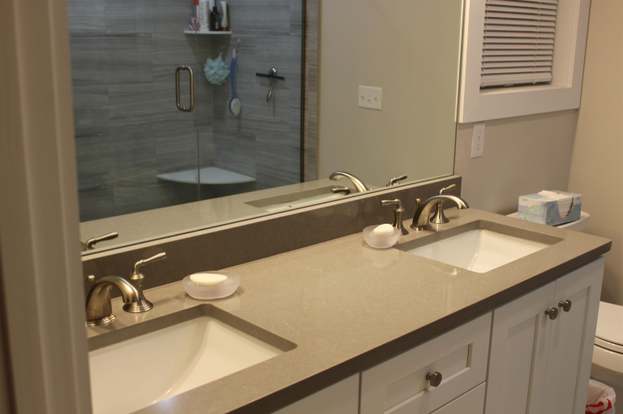
I want to click on left faucet, so click(x=124, y=286).